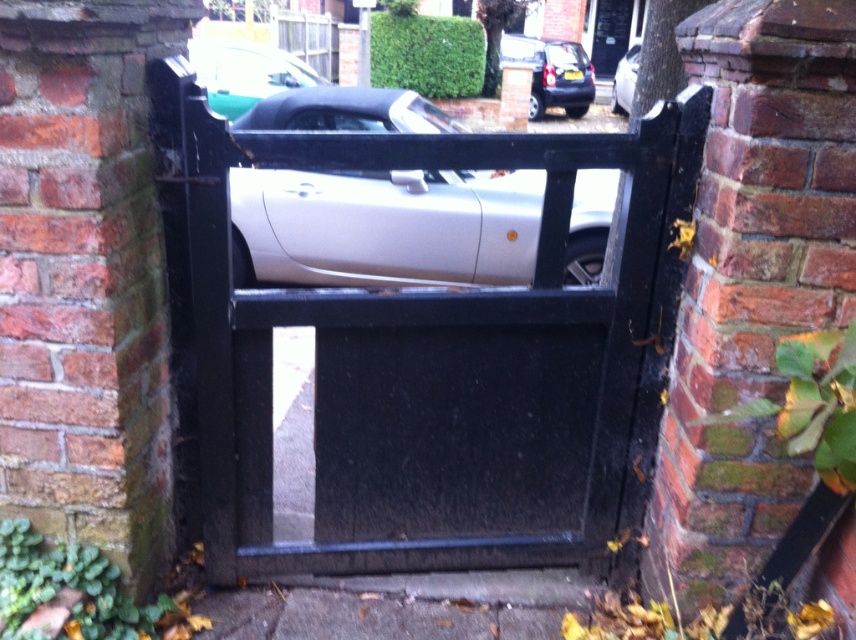
Question: Which point appears farthest from the camera in this image?

Choices:
 (A) (482, 493)
 (B) (569, 72)

Answer: (B)

Question: Considering the relative positions of green metallic car at upper center and satin silver car at center in the image provided, where is green metallic car at upper center located with respect to satin silver car at center?

Choices:
 (A) left
 (B) right

Answer: (A)

Question: Is green metallic car at upper center further to the viewer compared to satin silver car at center?

Choices:
 (A) yes
 (B) no

Answer: (B)

Question: Where is green metallic car at upper center located in relation to satin silver car at center in the image?

Choices:
 (A) above
 (B) below

Answer: (B)

Question: Which point is farther to the camera?

Choices:
 (A) (623, 84)
 (B) (403, 451)
 (C) (545, 65)
 (D) (201, 42)

Answer: (A)

Question: Which of the following is the closest to the observer?

Choices:
 (A) black glossy car at upper center
 (B) green metallic car at upper center
 (C) black wood gate at center
 (D) satin silver car at center

Answer: (C)